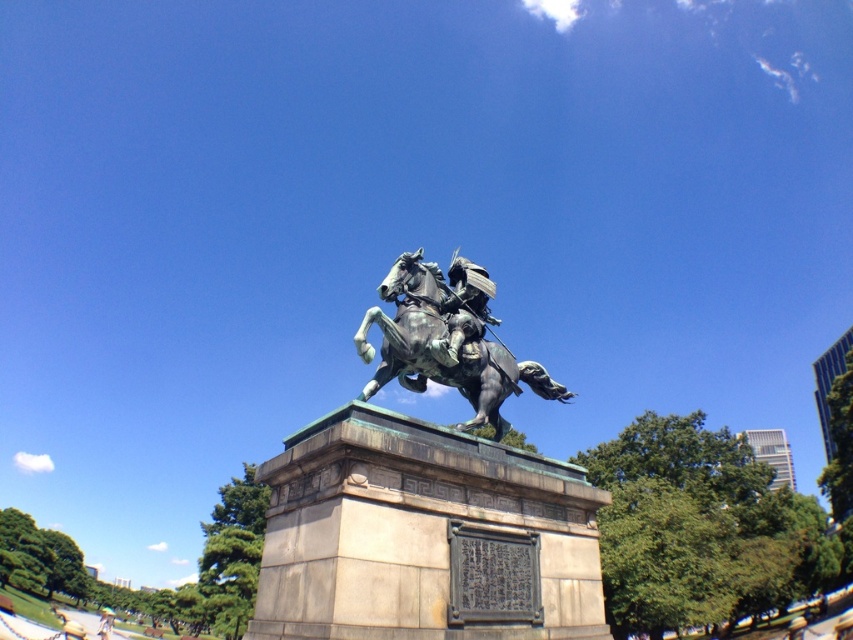
Question: Can you confirm if green patina statue at center is positioned to the left of bronze statue at center?

Choices:
 (A) yes
 (B) no

Answer: (A)

Question: Which object is closer to the camera taking this photo?

Choices:
 (A) green patina statue at center
 (B) bronze statue at center

Answer: (A)

Question: Is green patina statue at center smaller than bronze statue at center?

Choices:
 (A) yes
 (B) no

Answer: (A)

Question: Is green patina statue at center to the right of bronze statue at center from the viewer's perspective?

Choices:
 (A) yes
 (B) no

Answer: (B)